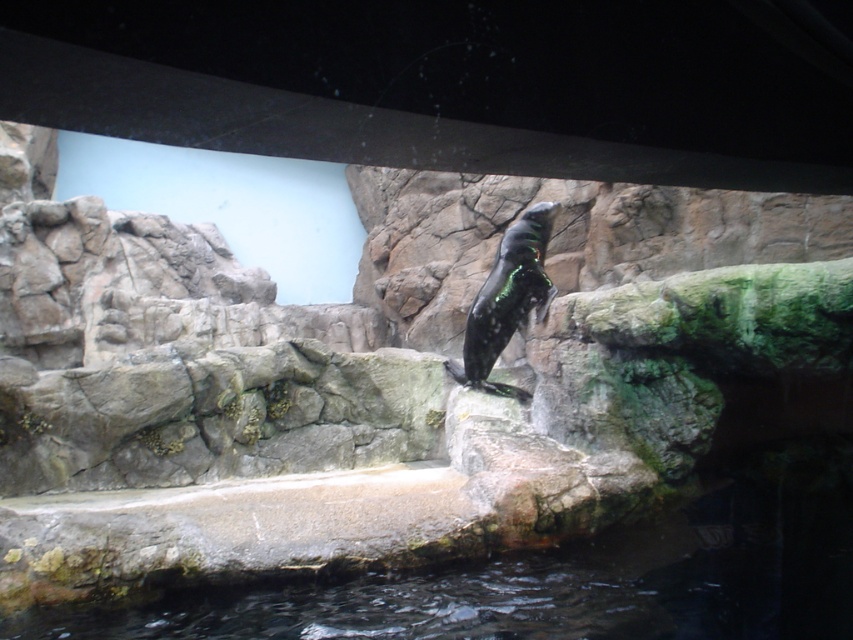
Question: Which point is farther from the camera taking this photo?

Choices:
 (A) (512, 324)
 (B) (399, 596)

Answer: (A)

Question: Is clear water at lower center closer to camera compared to shiny black penguin at center?

Choices:
 (A) yes
 (B) no

Answer: (A)

Question: Which point appears farthest from the camera in this image?

Choices:
 (A) (496, 356)
 (B) (457, 596)

Answer: (A)

Question: Can you confirm if clear water at lower center is smaller than shiny black penguin at center?

Choices:
 (A) no
 (B) yes

Answer: (A)

Question: From the image, what is the correct spatial relationship of clear water at lower center in relation to shiny black penguin at center?

Choices:
 (A) left
 (B) right

Answer: (A)